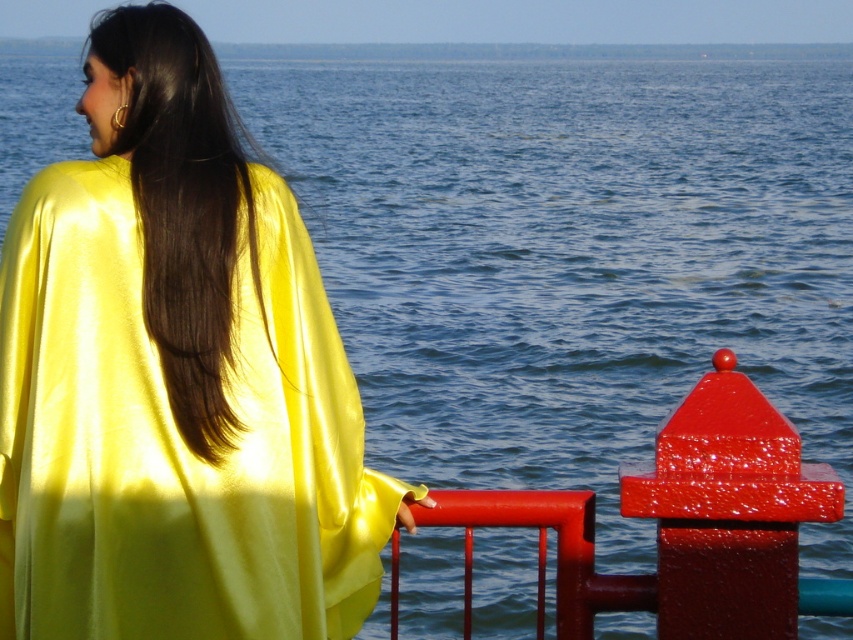
Based on the scene description, where is the shiny yellow cape at upper left located in terms of coordinates?

The shiny yellow cape at upper left is located at coordinates point (175, 378).

You are a photographer trying to capture the shiny yellow cape at upper left and the satin smooth hair at upper left in a single shot. Which object should you focus on first to ensure both are in focus?

A: You should focus on the shiny yellow cape at upper left first because it is closer to the viewer than the satin smooth hair at upper left, ensuring both will be in focus when focusing on the closer object.